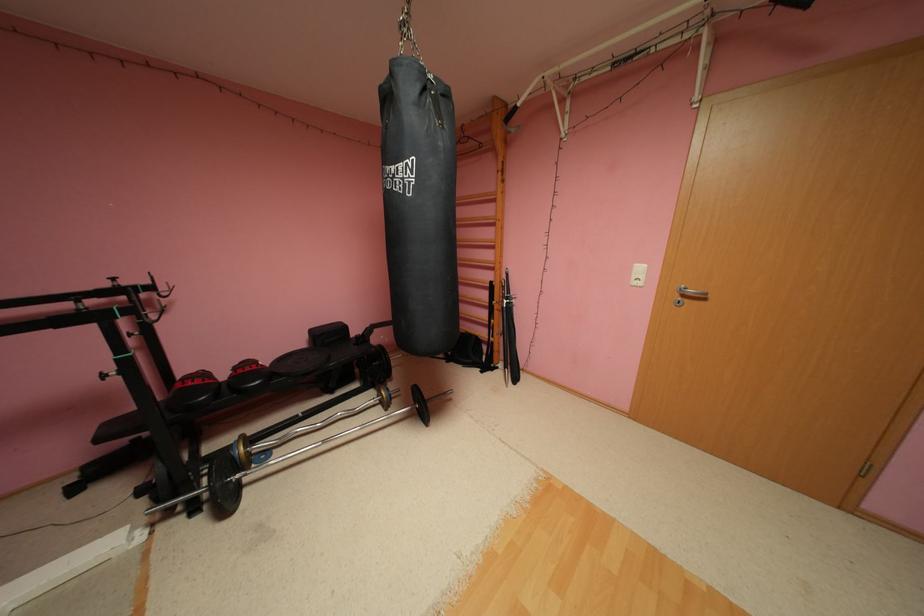
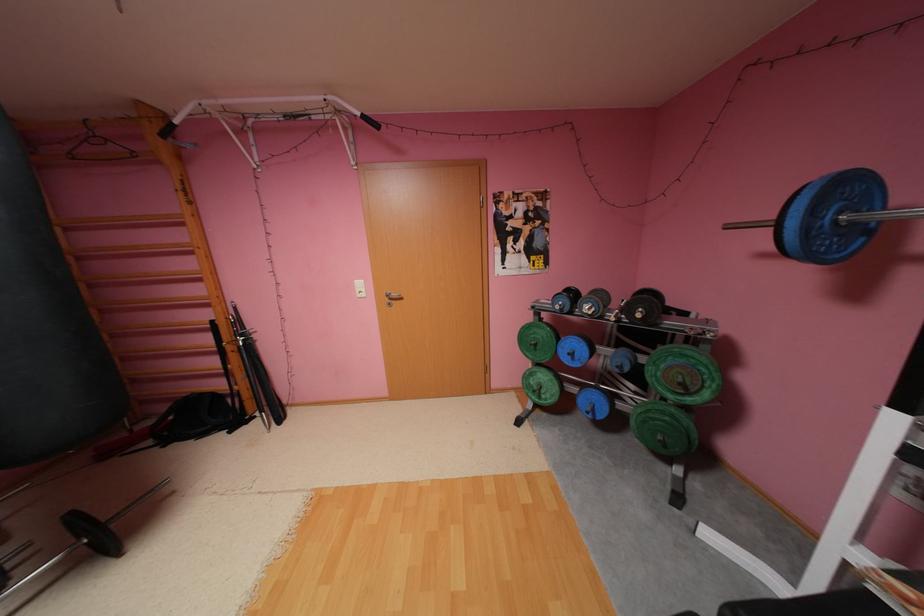
Where in the second image is the point corresponding to pixel 450 355 from the first image?

(157, 442)